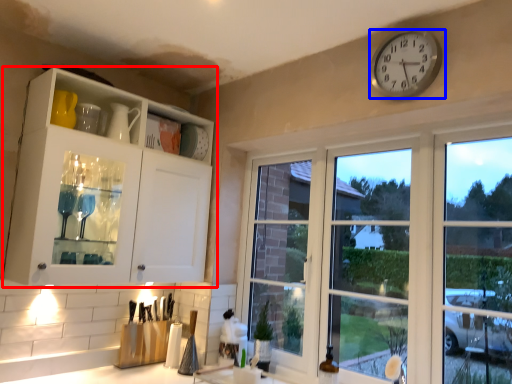
Question: Which object is closer to the camera taking this photo, cabinetry (highlighted by a red box) or wall clock (highlighted by a blue box)?

Choices:
 (A) cabinetry
 (B) wall clock

Answer: (B)